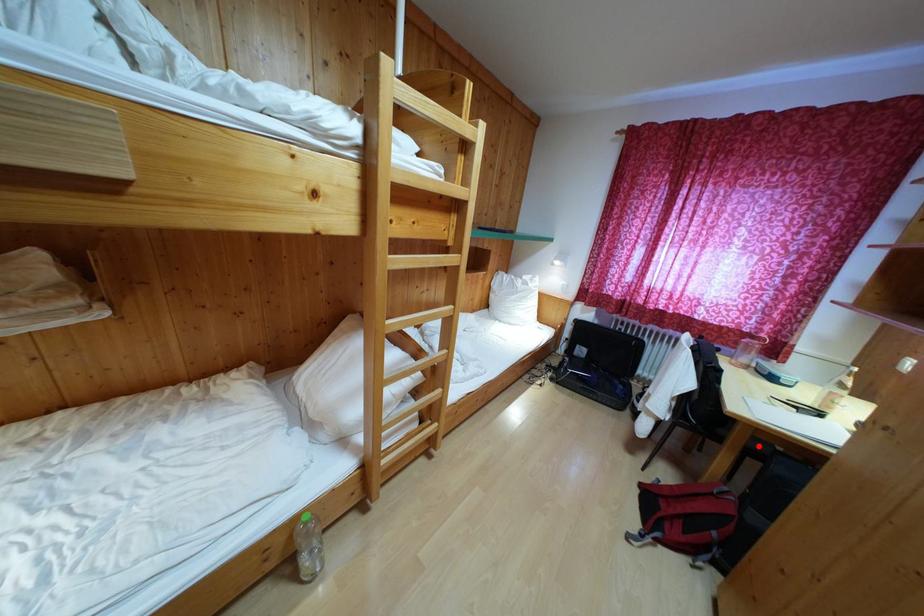
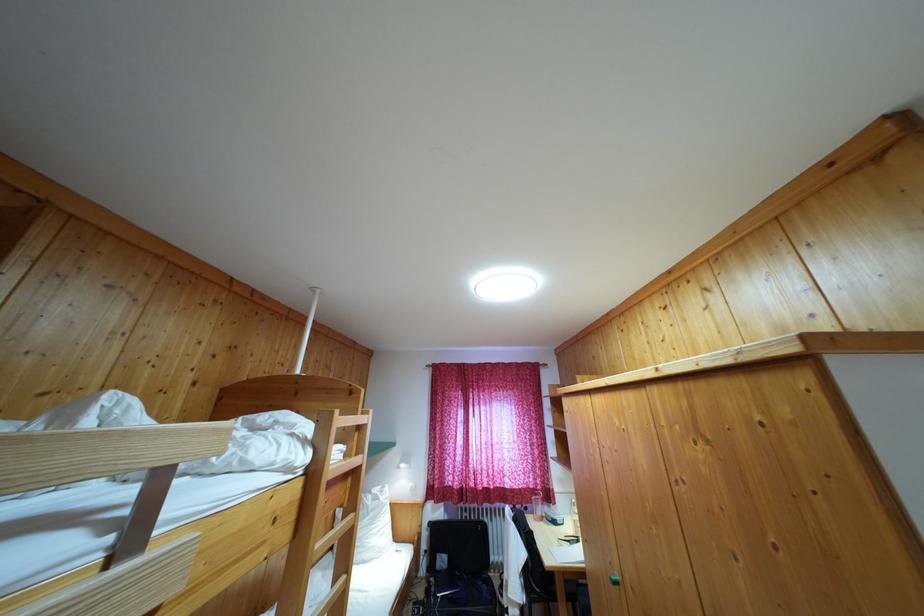
Locate, in the second image, the point that corresponds to the highlighted location in the first image.

(569, 589)